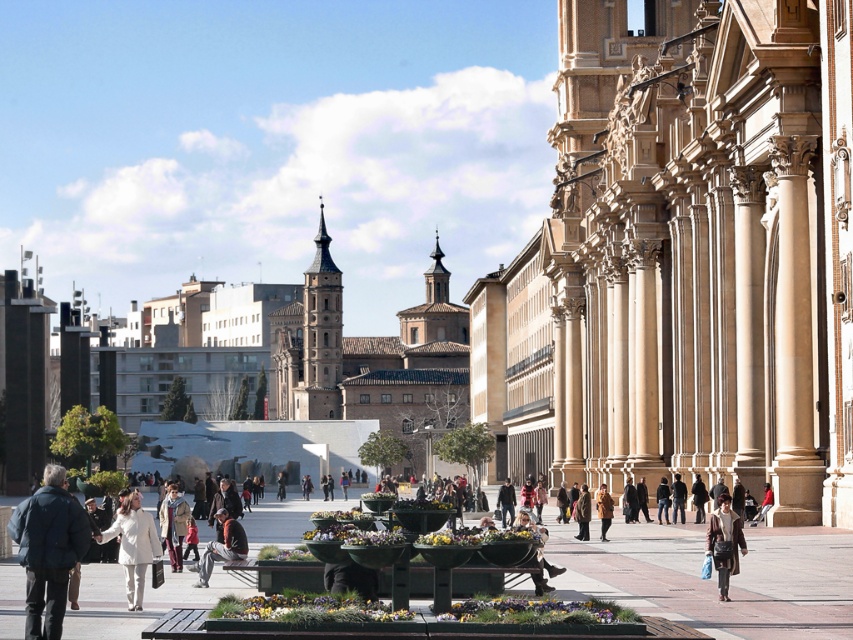
Measure the distance between white wool coat at center and brown leather jacket at center.

The distance of white wool coat at center from brown leather jacket at center is 3.11 meters.

I want to click on white wool coat at center, so click(132, 545).

Is white wool coat at center above denim jacket at center?

Indeed, white wool coat at center is positioned over denim jacket at center.

Is white wool coat at center shorter than denim jacket at center?

In fact, white wool coat at center may be taller than denim jacket at center.

Identify the location of white wool coat at center. The width and height of the screenshot is (853, 640). (132, 545).

Is brown leather jacket at center positioned behind denim jacket at center?

That is False.

Can you confirm if brown leather jacket at center is positioned below denim jacket at center?

Incorrect, brown leather jacket at center is not positioned below denim jacket at center.

Who is more forward, (222, 534) or (665, 499)?

Positioned in front is point (222, 534).

The width and height of the screenshot is (853, 640). Find the location of `brown leather jacket at center`. brown leather jacket at center is located at coordinates (222, 547).